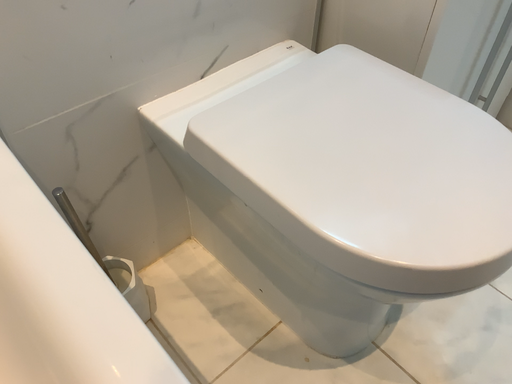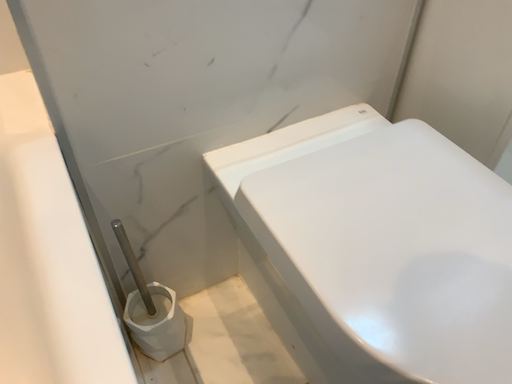
Question: Which way did the camera rotate in the video?

Choices:
 (A) rotated right
 (B) rotated left

Answer: (B)